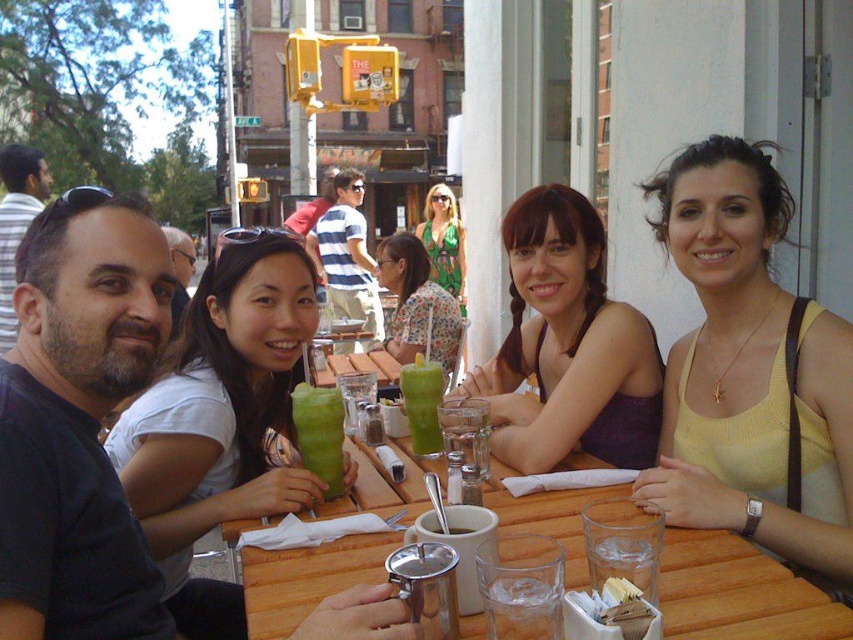
Question: Can you confirm if white fabric shirt at upper left is smaller than floral fabric shirt at center?

Choices:
 (A) no
 (B) yes

Answer: (B)

Question: Which point is closer to the camera?

Choices:
 (A) (508, 634)
 (B) (15, 152)

Answer: (A)

Question: Can you confirm if yellow knit tank top at upper right is wider than dark brown hair at left?

Choices:
 (A) no
 (B) yes

Answer: (B)

Question: Which object is closer to the camera taking this photo?

Choices:
 (A) striped cotton shirt at center
 (B) white fabric shirt at upper left

Answer: (B)

Question: Is white fabric shirt at upper left behind matte purple dress at center?

Choices:
 (A) yes
 (B) no

Answer: (B)

Question: Which is nearer to the matte purple dress at center?

Choices:
 (A) white fabric shirt at upper left
 (B) floral fabric shirt at center

Answer: (A)